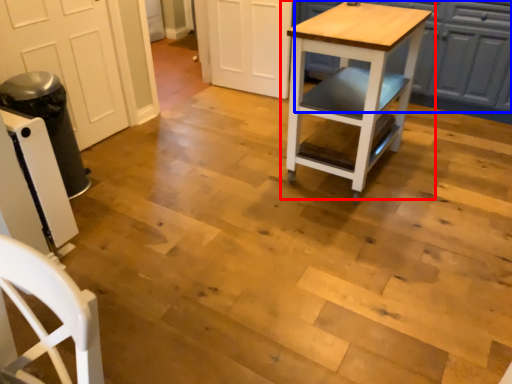
Question: Among these objects, which one is nearest to the camera, table (highlighted by a red box) or cabinetry (highlighted by a blue box)?

Choices:
 (A) table
 (B) cabinetry

Answer: (A)